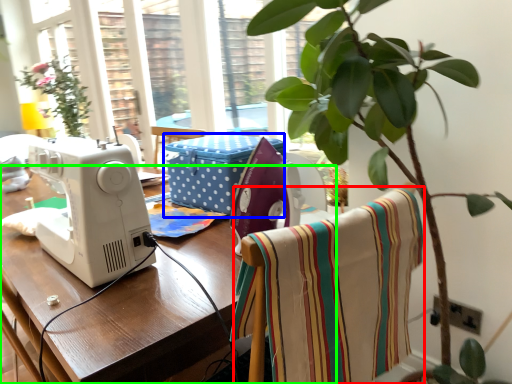
Question: Which object is positioned farthest from blanket (highlighted by a red box)? Select from box (highlighted by a blue box) and table (highlighted by a green box).

Choices:
 (A) box
 (B) table

Answer: (A)